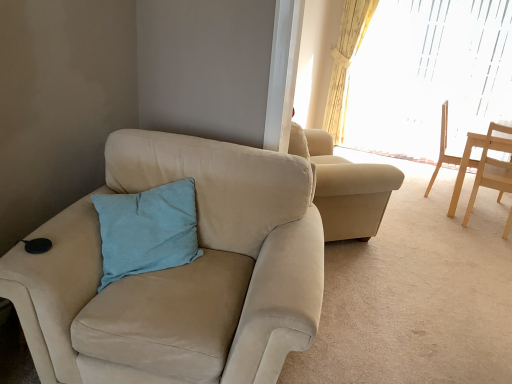
Question: From the image's perspective, relative to suede beige chair at left, the third chair in the right-to-left sequence, is light brown wooden chair at right, the 3th chair from the front, above or below?

Choices:
 (A) above
 (B) below

Answer: (A)

Question: Which is correct: light brown wooden chair at right, which is the second chair from right to left, is inside suede beige chair at left, arranged as the 1th chair when viewed from the left, or outside of it?

Choices:
 (A) outside
 (B) inside

Answer: (A)

Question: Which is farther from the light wood chair at right, which is the 2th chair from front to back?

Choices:
 (A) yellow floral fabric curtain at upper right
 (B) suede beige chair at left, acting as the third chair starting from the back
 (C) light blue fabric pillow at center
 (D) translucent glass window at upper right
 (E) light brown wooden chair at right, which is counted as the 1th chair, starting from the back

Answer: (D)

Question: Based on their relative distances, which object is farther from the light wood chair at right, which is the second chair from back to front?

Choices:
 (A) yellow floral fabric curtain at upper right
 (B) light blue fabric pillow at center
 (C) suede beige chair at left, acting as the 1th chair starting from the front
 (D) light brown wooden chair at right, which is the second chair from right to left
 (E) translucent glass window at upper right

Answer: (E)